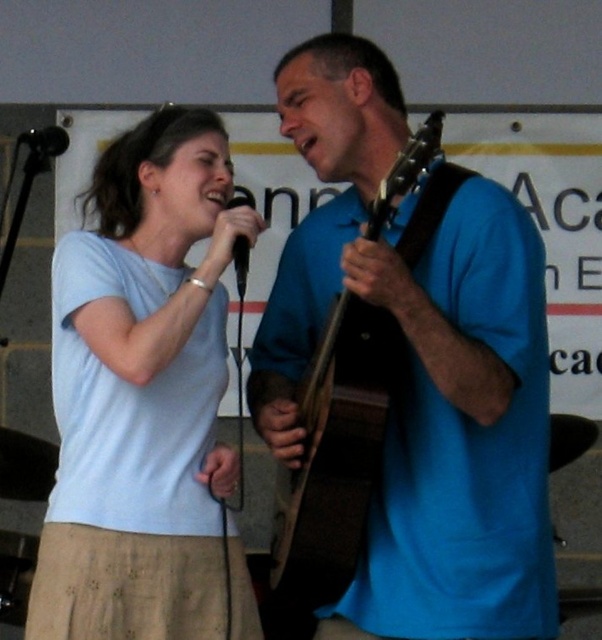
Question: Does light blue cotton shirt at center come behind black matte microphone at center?

Choices:
 (A) yes
 (B) no

Answer: (A)

Question: Does blue matte guitar at center have a smaller size compared to light blue cotton shirt at center?

Choices:
 (A) yes
 (B) no

Answer: (B)

Question: Based on their relative distances, which object is nearer to the black matte microphone at upper left?

Choices:
 (A) black matte microphone at center
 (B) light blue cotton shirt at center
 (C) blue matte guitar at center

Answer: (A)

Question: Can you confirm if blue matte guitar at center is bigger than black matte microphone at center?

Choices:
 (A) yes
 (B) no

Answer: (A)

Question: Which of the following is the farthest from the observer?

Choices:
 (A) (240, 253)
 (B) (45, 145)

Answer: (B)

Question: Which of the following is the farthest from the observer?

Choices:
 (A) (235, 260)
 (B) (220, 384)
 (C) (279, 115)

Answer: (C)